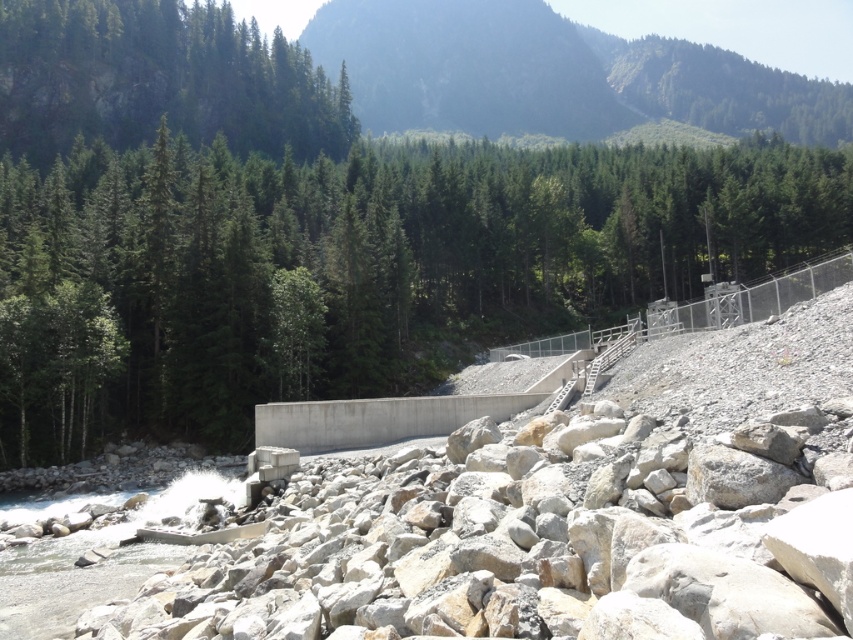
Question: Does green matte tree at upper center appear over green matte tree at upper left?

Choices:
 (A) no
 (B) yes

Answer: (A)

Question: Which of the following is the farthest from the observer?

Choices:
 (A) green forested mountain at upper center
 (B) green matte tree at upper left
 (C) green matte tree at upper center

Answer: (A)

Question: Among these points, which one is farthest from the camera?

Choices:
 (A) (44, 12)
 (B) (535, 321)
 (C) (547, 22)

Answer: (C)

Question: Which of the following is the farthest from the observer?

Choices:
 (A) (41, 24)
 (B) (177, 326)
 (C) (628, 42)

Answer: (C)

Question: Is green matte tree at upper center closer to the viewer compared to green matte tree at upper left?

Choices:
 (A) yes
 (B) no

Answer: (A)

Question: In this image, where is green matte tree at upper center located relative to green matte tree at upper left?

Choices:
 (A) right
 (B) left

Answer: (A)